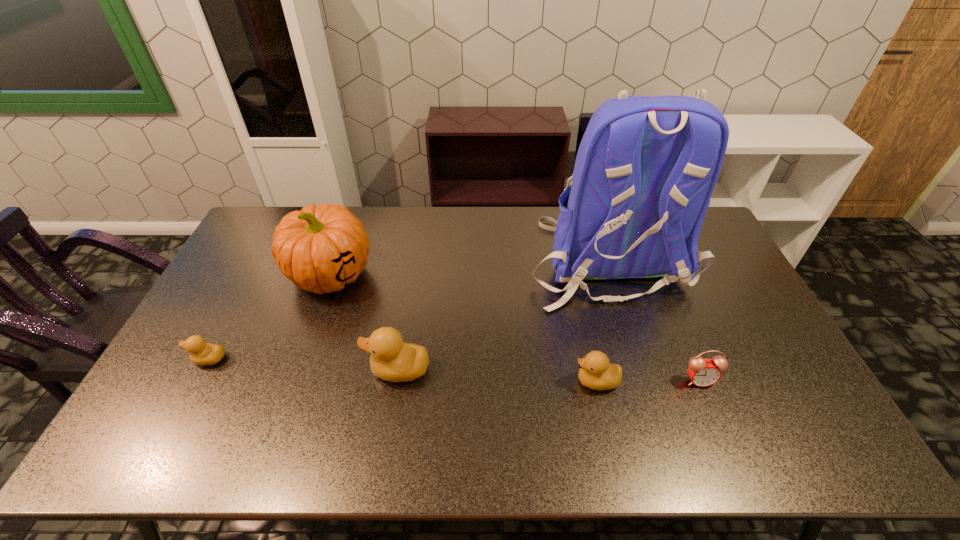
Locate an element on the screen. the shortest object is located at coordinates (201, 353).

The height and width of the screenshot is (540, 960). Identify the location of the leftmost object. (201, 353).

Locate an element on the screen. The height and width of the screenshot is (540, 960). the fourth object from right to left is located at coordinates (391, 359).

Find the location of a particular element. the fourth shortest object is located at coordinates pos(391,359).

Locate an element on the screen. Image resolution: width=960 pixels, height=540 pixels. the rightmost duckling is located at coordinates (595, 372).

The height and width of the screenshot is (540, 960). In order to click on backpack in this screenshot , I will do `click(646, 167)`.

The height and width of the screenshot is (540, 960). In order to click on the second object from left to right in this screenshot , I will do `click(320, 249)`.

Locate an element on the screen. the fifth shortest object is located at coordinates (320, 249).

Image resolution: width=960 pixels, height=540 pixels. What are the coordinates of `alarm clock` in the screenshot? It's located at (703, 372).

At what (x,y) coordinates should I click in order to perform the action: click on free point located on the face of the shortest duckling. Please return your answer as a coordinate pair (x, y). The height and width of the screenshot is (540, 960). Looking at the image, I should click on (173, 359).